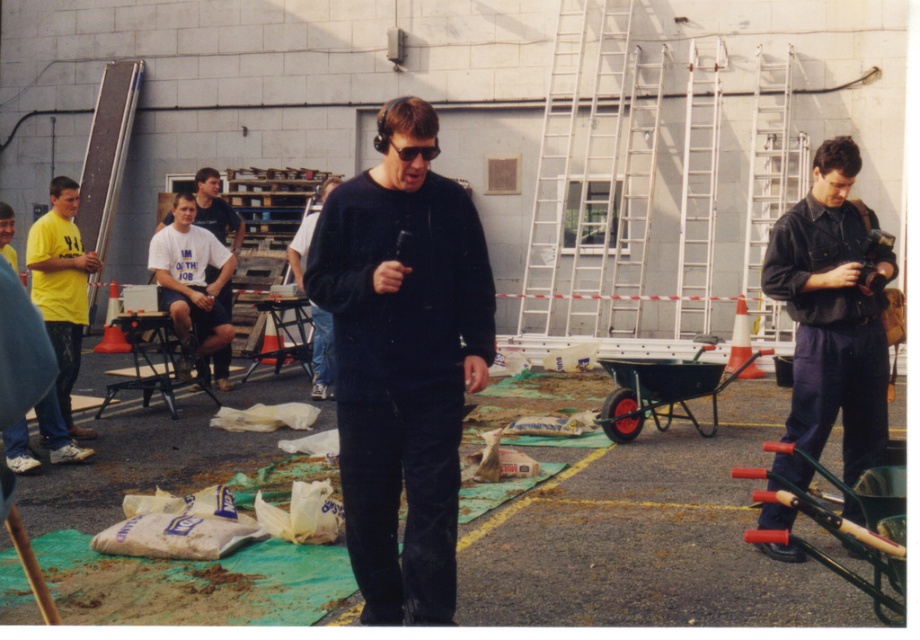
You are standing in the construction site and see the black matte shirt at center and the black plastic sunglasses at center. Which object is positioned lower from the ground?

The black matte shirt at center is located below black plastic sunglasses at center, so the black matte shirt at center is positioned lower from the ground.

You are a safety inspector at the construction site. You notice two workers wearing a dark blue denim jumpsuit at right and a black matte shirt at center. Which worker is taller?

The dark blue denim jumpsuit at right is taller than the black matte shirt at center.

You are standing at the construction site and want to place a safety cone between the two points labeled as point (842,253) and point (307,230). Which point should the cone be closer to in order to be nearer to the observer?

The safety cone should be placed closer to point (842,253) because it is nearer to the observer compared to point (307,230).